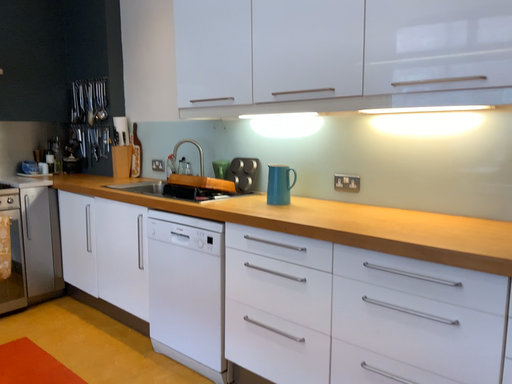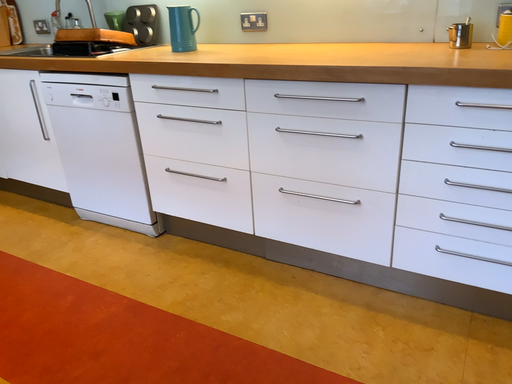
Question: Which way did the camera rotate in the video?

Choices:
 (A) rotated upward
 (B) rotated downward

Answer: (B)